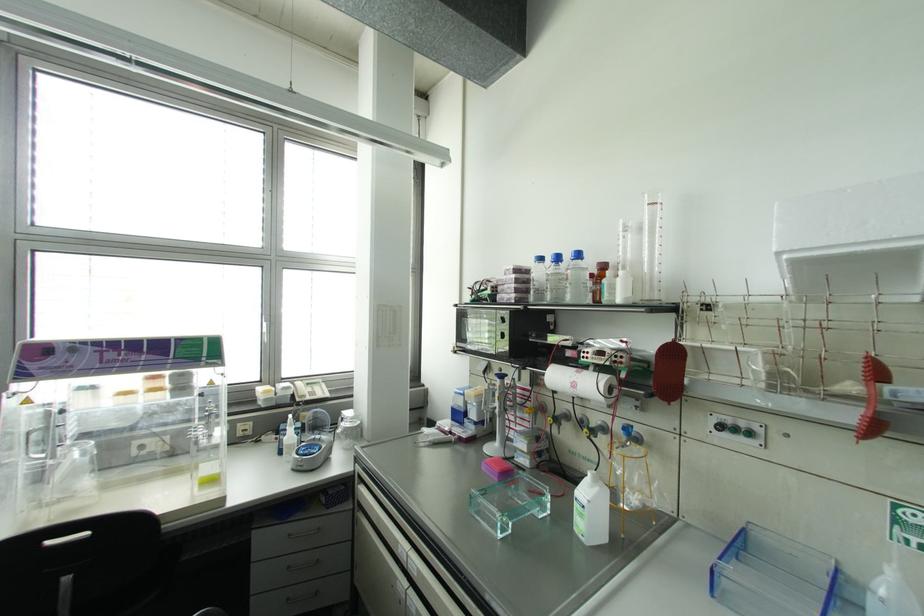
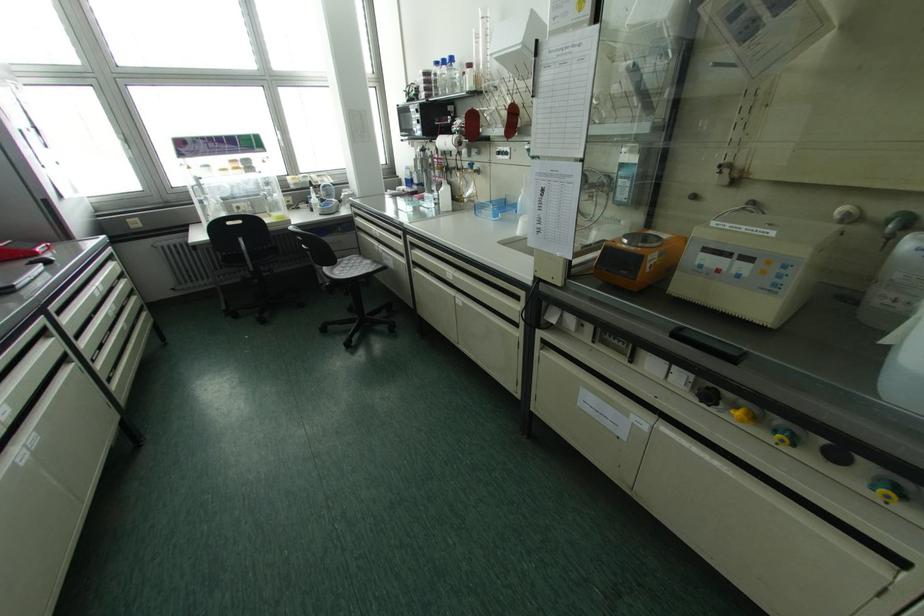
Find the pixel in the second image that matches (x=608, y=491) in the first image.

(448, 187)